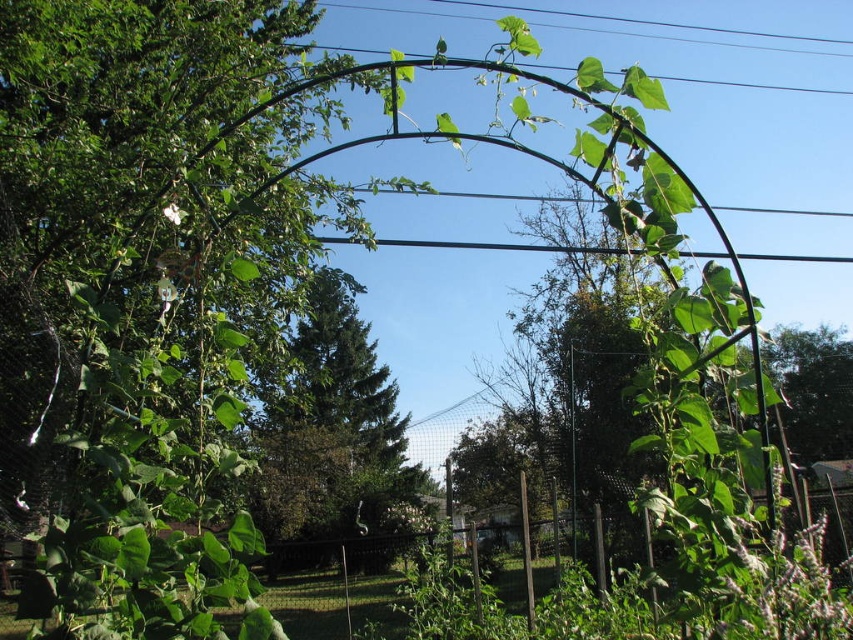
You are a gardener planning to install a new sprinkler system. You need to determine if the green matte trellis at center will block the water spray reaching the green leafy tree at center. Based on their positions, can the water reach the tree without obstruction?

The green matte trellis at center is located above the green leafy tree at center, so the sprinkler water might be blocked by the trellis, preventing it from reaching the tree.

You are standing in the garden and want to place a decorative statue between the green matte trellis at center and the green leafy tree at center. Based on their widths, which object should you position the statue closer to?

The green matte trellis at center might be wider than the green leafy tree at center, so you should position the statue closer to the green leafy tree at center to ensure it fits between them.

You are standing in the garden looking at the trellis. There are two points marked in the image. The first point is at coordinate point (51,186) and the second is at point (341,509). Which of these two points is closer to you?

Point (51,186) is in front of point (341,509), so the first point is closer to you.